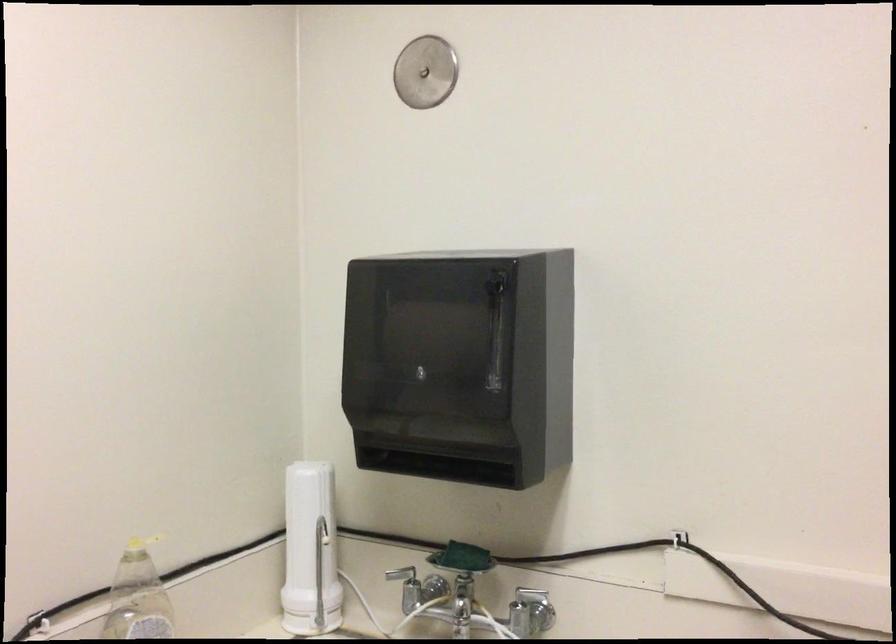
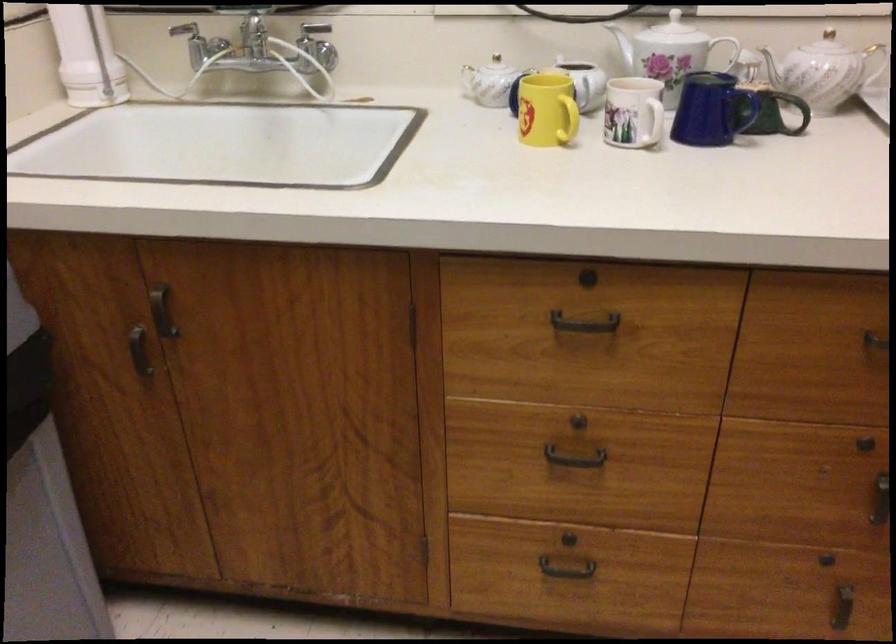
How did the camera likely rotate?

The camera rotated toward right-down.